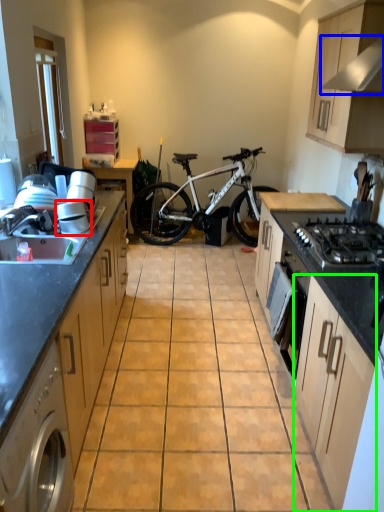
Question: Estimate the real-world distances between objects in this image. Which object is farther from appliance (highlighted by a red box), exhaust hood (highlighted by a blue box) or cabinetry (highlighted by a green box)?

Choices:
 (A) exhaust hood
 (B) cabinetry

Answer: (A)